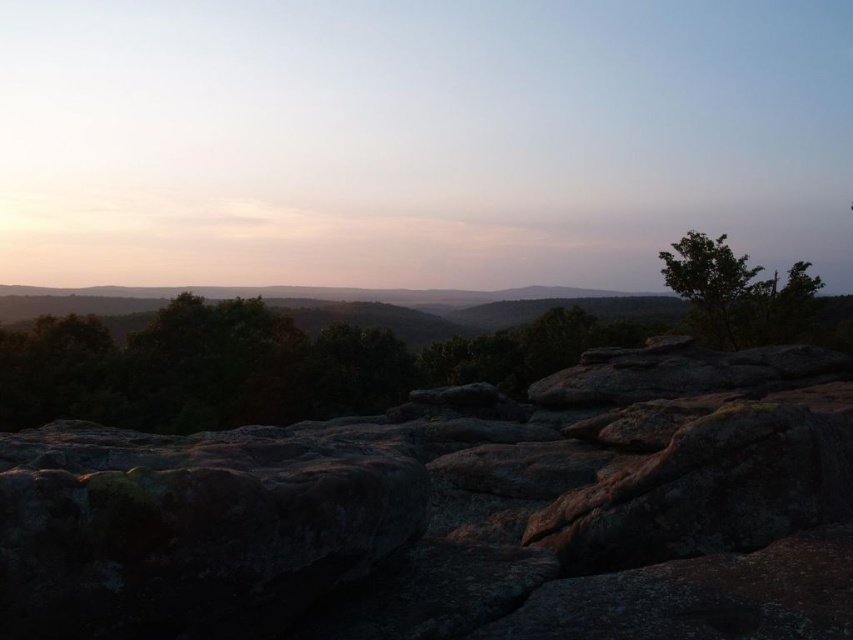
Is rusty stone boulder at center wider than green leafy tree at upper right?

Correct, the width of rusty stone boulder at center exceeds that of green leafy tree at upper right.

Is point (525, 584) positioned in front of point (737, 296)?

Yes, point (525, 584) is in front of point (737, 296).

Identify the location of rusty stone boulder at center. (457, 513).

Which is in front, point (335, 376) or point (718, 269)?

Positioned in front is point (718, 269).

Describe the element at coordinates (262, 364) in the screenshot. I see `green leafy tree at center` at that location.

Who is more distant from viewer, (167, 416) or (692, 298)?

Positioned behind is point (167, 416).

You are a GUI agent. You are given a task and a screenshot of the screen. Output one action in this format:
    pyautogui.click(x=<x>, y=<y>)
    Task: Click on the green leafy tree at center
    The height and width of the screenshot is (640, 853).
    Given the screenshot: What is the action you would take?
    pyautogui.click(x=262, y=364)

Which is more to the right, rusty stone boulder at center or green leafy tree at center?

From the viewer's perspective, rusty stone boulder at center appears more on the right side.

Can you confirm if rusty stone boulder at center is positioned below green leafy tree at center?

Yes, rusty stone boulder at center is below green leafy tree at center.

What do you see at coordinates (457, 513) in the screenshot? I see `rusty stone boulder at center` at bounding box center [457, 513].

Identify the location of rusty stone boulder at center. This screenshot has width=853, height=640. (457, 513).